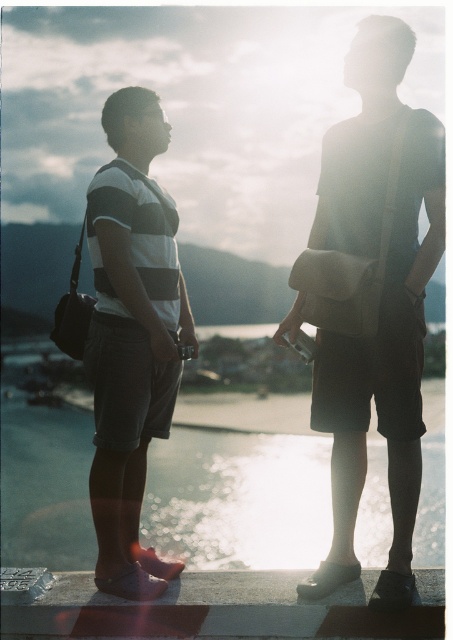
Can you confirm if matte beige bag at center is smaller than striped cotton shirt at left?

Actually, matte beige bag at center might be larger than striped cotton shirt at left.

Locate an element on the screen. This screenshot has width=453, height=640. matte beige bag at center is located at coordinates (384, 378).

Is point (388, 326) more distant than point (91, 352)?

No, (388, 326) is closer to viewer.

Find the location of a particular element. This screenshot has width=453, height=640. matte beige bag at center is located at coordinates (384, 378).

Does translucent glass water at center have a lesser height compared to striped cotton shirt at left?

Yes, translucent glass water at center is shorter than striped cotton shirt at left.

Is point (377, 484) behind point (91, 381)?

Yes, it is behind point (91, 381).

Find the location of a particular element. The height and width of the screenshot is (640, 453). translucent glass water at center is located at coordinates (239, 499).

Can you confirm if translucent glass water at center is shorter than matte beige bag at center?

Yes.

Is translucent glass water at center wider than matte beige bag at center?

No, translucent glass water at center is not wider than matte beige bag at center.

This screenshot has width=453, height=640. What do you see at coordinates (239, 499) in the screenshot? I see `translucent glass water at center` at bounding box center [239, 499].

Locate an element on the screen. translucent glass water at center is located at coordinates (239, 499).